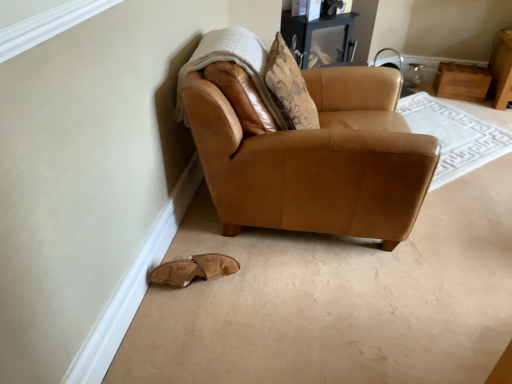
Question: Can you confirm if saddle brown leather armchair at lower left is positioned to the right of tan suede slipper at lower left?

Choices:
 (A) yes
 (B) no

Answer: (A)

Question: Can you confirm if saddle brown leather armchair at lower left is taller than tan suede slipper at lower left?

Choices:
 (A) no
 (B) yes

Answer: (B)

Question: Is tan suede slipper at lower left a part of saddle brown leather armchair at lower left?

Choices:
 (A) no
 (B) yes

Answer: (A)

Question: Is the position of saddle brown leather armchair at lower left more distant than that of tan suede slipper at lower left?

Choices:
 (A) yes
 (B) no

Answer: (B)

Question: Are saddle brown leather armchair at lower left and tan suede slipper at lower left located far from each other?

Choices:
 (A) yes
 (B) no

Answer: (B)

Question: Is saddle brown leather armchair at lower left not inside tan suede slipper at lower left?

Choices:
 (A) yes
 (B) no

Answer: (A)

Question: Can saddle brown leather armchair at lower left be found inside white textured blanket at upper left?

Choices:
 (A) yes
 (B) no

Answer: (B)

Question: From the image's perspective, is white textured blanket at upper left beneath saddle brown leather armchair at lower left?

Choices:
 (A) no
 (B) yes

Answer: (A)

Question: From a real-world perspective, is white textured blanket at upper left on top of saddle brown leather armchair at lower left?

Choices:
 (A) yes
 (B) no

Answer: (A)

Question: From the image's perspective, is white textured blanket at upper left on top of saddle brown leather armchair at lower left?

Choices:
 (A) no
 (B) yes

Answer: (B)

Question: Does white textured blanket at upper left have a greater width compared to saddle brown leather armchair at lower left?

Choices:
 (A) no
 (B) yes

Answer: (A)

Question: Is white textured blanket at upper left in front of saddle brown leather armchair at lower left?

Choices:
 (A) yes
 (B) no

Answer: (B)

Question: Is white textured blanket at upper left inside saddle brown leather armchair at lower left?

Choices:
 (A) yes
 (B) no

Answer: (A)